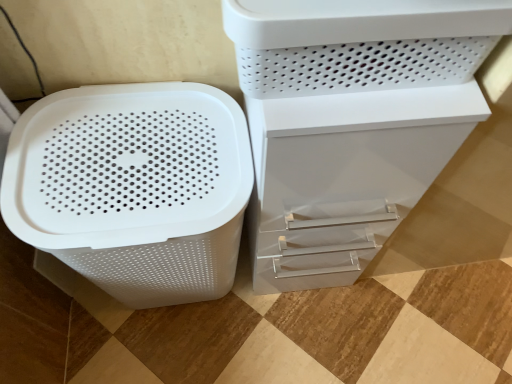
Question: From a real-world perspective, is white plastic file cabinet at center positioned under white plastic container at upper right based on gravity?

Choices:
 (A) no
 (B) yes

Answer: (B)

Question: Is white plastic file cabinet at center positioned with its back to white plastic container at upper right?

Choices:
 (A) no
 (B) yes

Answer: (A)

Question: Is white plastic file cabinet at center smaller than white plastic container at upper right?

Choices:
 (A) no
 (B) yes

Answer: (A)

Question: From the image's perspective, is white plastic file cabinet at center below white plastic container at upper right?

Choices:
 (A) no
 (B) yes

Answer: (B)

Question: Is white plastic file cabinet at center not inside white plastic container at upper right?

Choices:
 (A) no
 (B) yes

Answer: (B)

Question: In the image, is white plastic container at upper right on the left side or the right side of white plastic file cabinet at center?

Choices:
 (A) left
 (B) right

Answer: (A)

Question: Considering their positions, is white plastic container at upper right located in front of or behind white plastic file cabinet at center?

Choices:
 (A) front
 (B) behind

Answer: (A)

Question: Is point (424, 34) closer or farther from the camera than point (457, 140)?

Choices:
 (A) farther
 (B) closer

Answer: (B)

Question: Looking at the image, does white plastic container at upper right seem bigger or smaller compared to white plastic file cabinet at center?

Choices:
 (A) big
 (B) small

Answer: (B)

Question: From the image's perspective, is white matte plastic basket at left located above or below white plastic container at upper right?

Choices:
 (A) above
 (B) below

Answer: (B)

Question: Is white matte plastic basket at left wider or thinner than white plastic container at upper right?

Choices:
 (A) thin
 (B) wide

Answer: (B)

Question: In the image, is white matte plastic basket at left positioned in front of or behind white plastic container at upper right?

Choices:
 (A) behind
 (B) front

Answer: (A)

Question: Considering the positions of white matte plastic basket at left and white plastic container at upper right in the image, is white matte plastic basket at left bigger or smaller than white plastic container at upper right?

Choices:
 (A) small
 (B) big

Answer: (B)

Question: From a real-world perspective, is white plastic file cabinet at center above or below white plastic container at upper right?

Choices:
 (A) above
 (B) below

Answer: (B)

Question: In terms of height, does white plastic file cabinet at center look taller or shorter compared to white plastic container at upper right?

Choices:
 (A) tall
 (B) short

Answer: (A)